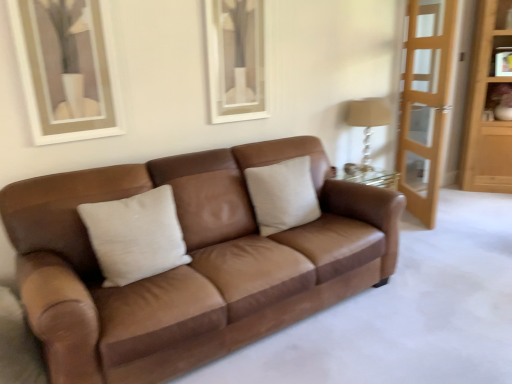
Describe the element at coordinates (191, 263) in the screenshot. I see `brown leather couch at center` at that location.

What do you see at coordinates (489, 103) in the screenshot? I see `light brown wooden dresser at right` at bounding box center [489, 103].

The height and width of the screenshot is (384, 512). What do you see at coordinates (282, 195) in the screenshot? I see `beige fabric pillow at center` at bounding box center [282, 195].

Where is `light wood screen door at right`? The height and width of the screenshot is (384, 512). light wood screen door at right is located at coordinates (x=425, y=103).

Which of these two, light wood screen door at right or beige fabric pillow at center, is wider?

With larger width is beige fabric pillow at center.

Does light wood screen door at right have a greater height compared to beige fabric pillow at center?

Indeed, light wood screen door at right has a greater height compared to beige fabric pillow at center.

In the scene shown: Is light brown wooden dresser at right thinner than beige fabric lampshade at right?

No.

From a real-world perspective, which is physically above, light brown wooden dresser at right or beige fabric lampshade at right?

light brown wooden dresser at right, from a real-world perspective.

From the image's perspective, which is above, light brown wooden dresser at right or beige fabric lampshade at right?

light brown wooden dresser at right.

Can you confirm if matte brown vase at upper right is thinner than brown leather couch at center?

Yes, matte brown vase at upper right is thinner than brown leather couch at center.

How much distance is there between matte brown vase at upper right and brown leather couch at center?

3.42 meters.

Where is `studio couch below the matte brown vase at upper right (from the image's perspective)`? The width and height of the screenshot is (512, 384). studio couch below the matte brown vase at upper right (from the image's perspective) is located at coordinates (191, 263).

Does beige fabric lampshade at right have a smaller size compared to matte brown vase at upper right?

Actually, beige fabric lampshade at right might be larger than matte brown vase at upper right.

Can we say beige fabric lampshade at right lies outside matte brown vase at upper right?

Yes, beige fabric lampshade at right is located beyond the bounds of matte brown vase at upper right.

In terms of width, does beige fabric lampshade at right look wider or thinner when compared to matte brown vase at upper right?

In the image, beige fabric lampshade at right appears to be more narrow than matte brown vase at upper right.

Is beige fabric lampshade at right with matte brown vase at upper right?

There is a gap between beige fabric lampshade at right and matte brown vase at upper right.

What are the coordinates of `studio couch that is on the left side of light wood screen door at right` in the screenshot? It's located at (191, 263).

Can you confirm if brown leather couch at center is positioned to the right of light wood screen door at right?

Incorrect, brown leather couch at center is not on the right side of light wood screen door at right.

Between point (390, 219) and point (431, 65), which one is positioned behind?

The point (431, 65) is farther from the camera.

Can you confirm if brown leather couch at center is taller than light wood screen door at right?

Incorrect, the height of brown leather couch at center is not larger of that of light wood screen door at right.

Based on their sizes in the image, would you say beige fabric lampshade at right is bigger or smaller than beige fabric pillow at center?

Clearly, beige fabric lampshade at right is smaller in size than beige fabric pillow at center.

From the picture: Which object is thinner, beige fabric lampshade at right or beige fabric pillow at center?

beige fabric pillow at center is thinner.

How different are the orientations of beige fabric lampshade at right and beige fabric pillow at center in degrees?

0.000504 degrees.

Considering the points (418, 169) and (485, 131), which point is behind, point (418, 169) or point (485, 131)?

The point (485, 131) is more distant.

Choose the correct answer: Is light wood screen door at right inside light brown wooden dresser at right or outside it?

light wood screen door at right lies outside light brown wooden dresser at right.

At what (x,y) coordinates should I click in order to perform the action: click on dresser above the light wood screen door at right (from the image's perspective). Please return your answer as a coordinate pair (x, y). Looking at the image, I should click on (489, 103).

Find the location of a particular element. screen door on the right of the beige fabric pillow at center is located at coordinates (425, 103).

In the image, there is a light brown wooden dresser at right. Identify the location of table lamp below it (from the image's perspective). (368, 121).

From the image, which object appears to be nearer to brown leather couch at center, beige fabric pillow at center or light brown wooden dresser at right?

beige fabric pillow at center is positioned closer to the anchor brown leather couch at center.

From the image, which object appears to be nearer to light brown wooden dresser at right, matte brown vase at upper right or light wood screen door at right?

The object closer to light brown wooden dresser at right is matte brown vase at upper right.

Considering their positions, is matte brown vase at upper right positioned further to light wood screen door at right than brown leather couch at center?

brown leather couch at center.

Based on their spatial positions, is brown leather couch at center or light wood screen door at right further from beige fabric lampshade at right?

The object further to beige fabric lampshade at right is brown leather couch at center.

From the image, which object appears to be farther from brown leather couch at center, light brown wooden dresser at right or beige fabric lampshade at right?

Based on the image, light brown wooden dresser at right appears to be further to brown leather couch at center.

When comparing their distances from matte brown vase at upper right, does light wood screen door at right or beige fabric pillow at center seem closer?

Among the two, light wood screen door at right is located nearer to matte brown vase at upper right.

Based on their spatial positions, is matte brown vase at upper right or light brown wooden dresser at right closer to brown leather couch at center?

light brown wooden dresser at right lies closer to brown leather couch at center than the other object.

Looking at the image, which one is located further to matte brown vase at upper right, light brown wooden dresser at right or beige fabric pillow at center?

Based on the image, beige fabric pillow at center appears to be further to matte brown vase at upper right.

Where is `pillow between brown leather couch at center and light brown wooden dresser at right in the horizontal direction`? The height and width of the screenshot is (384, 512). pillow between brown leather couch at center and light brown wooden dresser at right in the horizontal direction is located at coordinates (282, 195).

The width and height of the screenshot is (512, 384). Find the location of `table lamp located between beige fabric pillow at center and matte brown vase at upper right in the left-right direction`. table lamp located between beige fabric pillow at center and matte brown vase at upper right in the left-right direction is located at coordinates (368, 121).

Identify the location of screen door located between beige fabric pillow at center and light brown wooden dresser at right in the left-right direction. Image resolution: width=512 pixels, height=384 pixels. (425, 103).

At what (x,y) coordinates should I click in order to perform the action: click on screen door between brown leather couch at center and beige fabric lampshade at right from front to back. Please return your answer as a coordinate pair (x, y). Looking at the image, I should click on (425, 103).